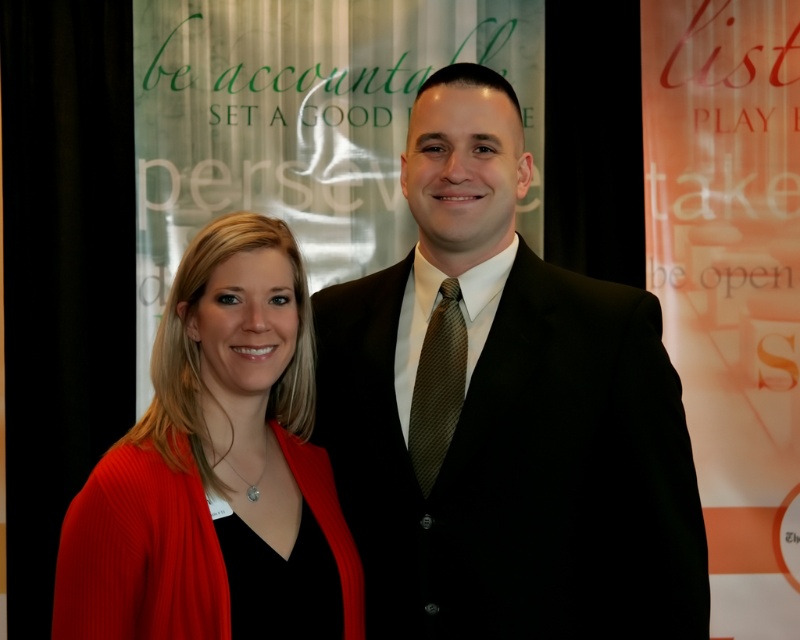
Question: In this image, where is knitted red cardigan at left located relative to brown textured tie at center?

Choices:
 (A) right
 (B) left

Answer: (B)

Question: Does black suit at center appear on the left side of knitted red cardigan at left?

Choices:
 (A) no
 (B) yes

Answer: (A)

Question: Among these objects, which one is nearest to the camera?

Choices:
 (A) brown textured tie at center
 (B) black suit at center
 (C) knitted red cardigan at left

Answer: (C)

Question: Which of the following is the closest to the observer?

Choices:
 (A) (558, 492)
 (B) (318, 458)

Answer: (A)

Question: Which point is closer to the camera?

Choices:
 (A) black suit at center
 (B) brown textured tie at center

Answer: (A)

Question: Is knitted red cardigan at left positioned at the back of brown textured tie at center?

Choices:
 (A) no
 (B) yes

Answer: (A)